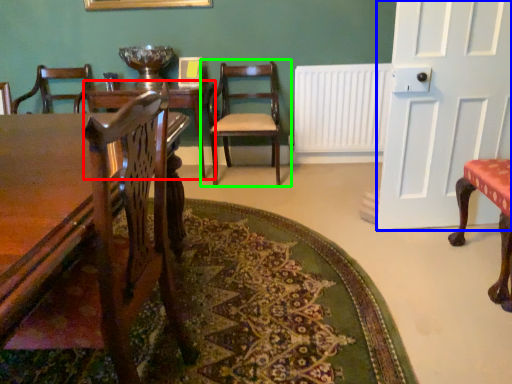
Question: Estimate the real-world distances between objects in this image. Which object is farther from table (highlighted by a red box), door (highlighted by a blue box) or chair (highlighted by a green box)?

Choices:
 (A) door
 (B) chair

Answer: (A)